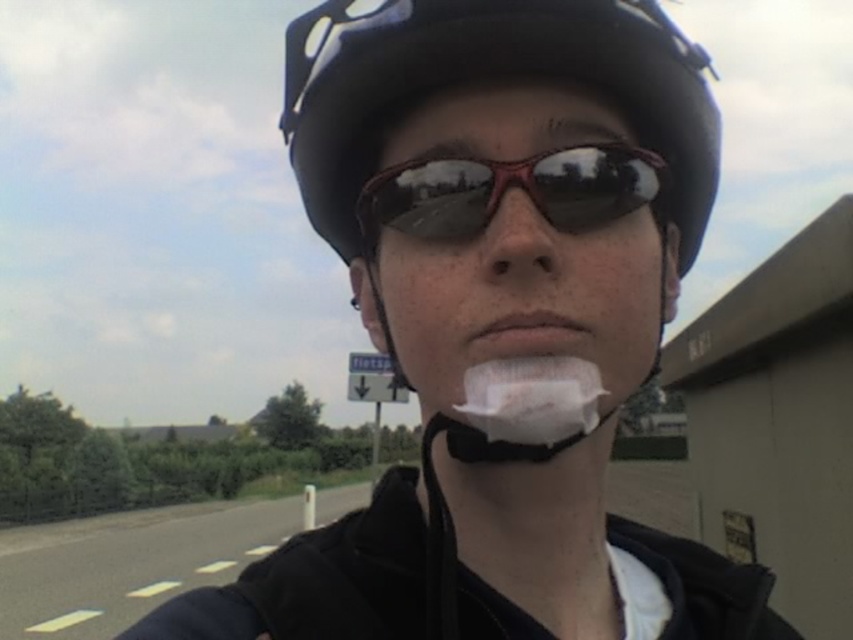
Which is more to the left, matte black helmet at center or matte skin nose at center?

matte skin nose at center

Locate an element on the screen. The height and width of the screenshot is (640, 853). matte black helmet at center is located at coordinates (492, 131).

Consider the image. Measure the distance between point (543, 384) and camera.

A distance of 14.36 inches exists between point (543, 384) and camera.

Is white matte shaving cream at center to the left of matte skin nose at center from the viewer's perspective?

Incorrect, white matte shaving cream at center is not on the left side of matte skin nose at center.

The height and width of the screenshot is (640, 853). Identify the location of white matte shaving cream at center. (532, 397).

Consider the image. How much distance is there between shiny black goggles at center and matte skin nose at center?

They are 1.39 inches apart.

Does point (421, 216) lie behind point (541, 250)?

Yes, it is behind point (541, 250).

The height and width of the screenshot is (640, 853). Find the location of `shiny black goggles at center`. shiny black goggles at center is located at coordinates (505, 189).